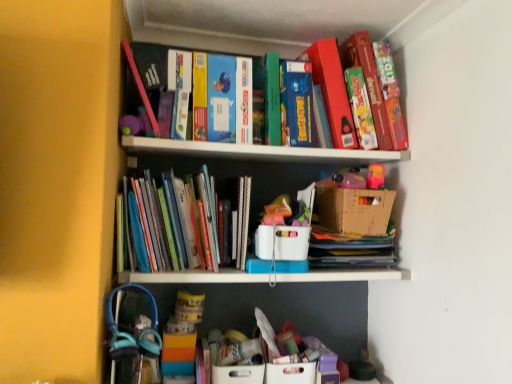
This screenshot has width=512, height=384. What do you see at coordinates (173, 224) in the screenshot?
I see `hardcover books at center` at bounding box center [173, 224].

The width and height of the screenshot is (512, 384). In order to click on hardcover books at center in this screenshot , I will do `click(173, 224)`.

Locate an element on the screen. Image resolution: width=512 pixels, height=384 pixels. hardcover books at center is located at coordinates (173, 224).

In the scene shown: Is cardboard box at upper center, placed as the second cardboard box when sorted from left to right, shorter than hardcover books at center?

Yes.

Which is more to the left, cardboard box at upper center, which is the first cardboard box in right-to-left order, or hardcover books at center?

hardcover books at center.

Based on their sizes in the image, would you say cardboard box at upper center, which is the first cardboard box in right-to-left order, is bigger or smaller than hardcover books at center?

cardboard box at upper center, which is the first cardboard box in right-to-left order, is smaller than hardcover books at center.

From the image's perspective, is cardboard box at upper center, placed as the second cardboard box when sorted from left to right, below hardcover books at center?

No, from the image's perspective, cardboard box at upper center, placed as the second cardboard box when sorted from left to right, is not below hardcover books at center.

You are a GUI agent. You are given a task and a screenshot of the screen. Output one action in this format:
    pyautogui.click(x=<x>, y=<y>)
    Task: Click on the book that is in front of the white cardboard box at center, positioned as the 1th cardboard box in left-to-right order
    The image size is (512, 384).
    Given the screenshot: What is the action you would take?
    pyautogui.click(x=173, y=224)

Which object is closer to the camera, white cardboard box at center, positioned as the 1th cardboard box in left-to-right order, or hardcover books at center?

hardcover books at center is more forward.

Considering the sizes of objects white cardboard box at center, the second cardboard box in the right-to-left sequence, and hardcover books at center in the image provided, who is bigger, white cardboard box at center, the second cardboard box in the right-to-left sequence, or hardcover books at center?

With larger size is hardcover books at center.

From the picture: From the image's perspective, which is above, white cardboard box at center, the second cardboard box in the right-to-left sequence, or hardcover books at center?

hardcover books at center, from the image's perspective.

From a real-world perspective, which is physically above, hardcover books at center or white cardboard box at center, positioned as the 1th cardboard box in left-to-right order?

In real-world perspective, hardcover books at center is above.

How far apart are hardcover books at center and white cardboard box at center, the second cardboard box in the right-to-left sequence?

hardcover books at center and white cardboard box at center, the second cardboard box in the right-to-left sequence, are 22.92 centimeters apart from each other.

Considering the relative positions of hardcover books at center and white cardboard box at center, the second cardboard box in the right-to-left sequence, in the image provided, is hardcover books at center in front of white cardboard box at center, the second cardboard box in the right-to-left sequence,?

Yes, it is in front of white cardboard box at center, the second cardboard box in the right-to-left sequence.

Looking at this image, considering the sizes of hardcover books at center and white cardboard box at center, positioned as the 1th cardboard box in left-to-right order, in the image, is hardcover books at center taller or shorter than white cardboard box at center, positioned as the 1th cardboard box in left-to-right order,?

In the image, hardcover books at center appears to be taller than white cardboard box at center, positioned as the 1th cardboard box in left-to-right order.

From the picture: Does hardcover books at center have a greater height compared to cardboard box at upper center, placed as the second cardboard box when sorted from left to right?

Yes, hardcover books at center is taller than cardboard box at upper center, placed as the second cardboard box when sorted from left to right.

Considering the relative positions of hardcover books at center and cardboard box at upper center, which is the first cardboard box in right-to-left order, in the image provided, is hardcover books at center in front of cardboard box at upper center, which is the first cardboard box in right-to-left order,?

Yes, the depth of hardcover books at center is less than that of cardboard box at upper center, which is the first cardboard box in right-to-left order.

From the image's perspective, which one is positioned lower, hardcover books at center or cardboard box at upper center, placed as the second cardboard box when sorted from left to right?

hardcover books at center is shown below in the image.

What's the angular difference between white cardboard box at center, the second cardboard box in the right-to-left sequence, and cardboard box at upper center, placed as the second cardboard box when sorted from left to right,'s facing directions?

The facing directions of white cardboard box at center, the second cardboard box in the right-to-left sequence, and cardboard box at upper center, placed as the second cardboard box when sorted from left to right, are 6.61e-06 degrees apart.

Is white cardboard box at center, the second cardboard box in the right-to-left sequence, at the right side of cardboard box at upper center, placed as the second cardboard box when sorted from left to right?

Incorrect, white cardboard box at center, the second cardboard box in the right-to-left sequence, is not on the right side of cardboard box at upper center, placed as the second cardboard box when sorted from left to right.

Does white cardboard box at center, positioned as the 1th cardboard box in left-to-right order, have a larger size compared to cardboard box at upper center, which is the first cardboard box in right-to-left order?

Actually, white cardboard box at center, positioned as the 1th cardboard box in left-to-right order, might be smaller than cardboard box at upper center, which is the first cardboard box in right-to-left order.

Is white cardboard box at center, positioned as the 1th cardboard box in left-to-right order, looking in the opposite direction of cardboard box at upper center, placed as the second cardboard box when sorted from left to right?

No, white cardboard box at center, positioned as the 1th cardboard box in left-to-right order, is not facing away from cardboard box at upper center, placed as the second cardboard box when sorted from left to right.

From a real-world perspective, is cardboard box at upper center, placed as the second cardboard box when sorted from left to right, physically located above or below white cardboard box at center, the second cardboard box in the right-to-left sequence?

From a real-world perspective, cardboard box at upper center, placed as the second cardboard box when sorted from left to right, is physically above white cardboard box at center, the second cardboard box in the right-to-left sequence.

Looking at this image, is cardboard box at upper center, placed as the second cardboard box when sorted from left to right, surrounding white cardboard box at center, positioned as the 1th cardboard box in left-to-right order?

Actually, white cardboard box at center, positioned as the 1th cardboard box in left-to-right order, is outside cardboard box at upper center, placed as the second cardboard box when sorted from left to right.

From the image's perspective, is cardboard box at upper center, placed as the second cardboard box when sorted from left to right, under white cardboard box at center, the second cardboard box in the right-to-left sequence?

No, from the image's perspective, cardboard box at upper center, placed as the second cardboard box when sorted from left to right, is not below white cardboard box at center, the second cardboard box in the right-to-left sequence.

Considering the sizes of objects cardboard box at upper center, which is the first cardboard box in right-to-left order, and white cardboard box at center, positioned as the 1th cardboard box in left-to-right order, in the image provided, who is wider, cardboard box at upper center, which is the first cardboard box in right-to-left order, or white cardboard box at center, positioned as the 1th cardboard box in left-to-right order,?

Wider between the two is white cardboard box at center, positioned as the 1th cardboard box in left-to-right order.

At what (x,y) coordinates should I click in order to perform the action: click on book that appears in front of the cardboard box at upper center, placed as the second cardboard box when sorted from left to right. Please return your answer as a coordinate pair (x, y). Looking at the image, I should click on (173, 224).

I want to click on the 1st cardboard box behind the hardcover books at center, starting your count from the anchor, so [282, 242].

Estimate the real-world distances between objects in this image. Which object is closer to hardcover books at center, white cardboard box at center, the second cardboard box in the right-to-left sequence, or cardboard box at upper center, placed as the second cardboard box when sorted from left to right?

white cardboard box at center, the second cardboard box in the right-to-left sequence.

Based on their spatial positions, is white cardboard box at center, positioned as the 1th cardboard box in left-to-right order, or hardcover books at center closer to cardboard box at upper center, placed as the second cardboard box when sorted from left to right?

Based on the image, white cardboard box at center, positioned as the 1th cardboard box in left-to-right order, appears to be nearer to cardboard box at upper center, placed as the second cardboard box when sorted from left to right.

Based on the photo, considering their positions, is cardboard box at upper center, placed as the second cardboard box when sorted from left to right, positioned closer to hardcover books at center than white cardboard box at center, positioned as the 1th cardboard box in left-to-right order?

white cardboard box at center, positioned as the 1th cardboard box in left-to-right order, is positioned closer to the anchor hardcover books at center.

When comparing their distances from white cardboard box at center, positioned as the 1th cardboard box in left-to-right order, does hardcover books at center or cardboard box at upper center, placed as the second cardboard box when sorted from left to right, seem closer?

cardboard box at upper center, placed as the second cardboard box when sorted from left to right.

Based on their spatial positions, is hardcover books at center or white cardboard box at center, the second cardboard box in the right-to-left sequence, closer to cardboard box at upper center, which is the first cardboard box in right-to-left order?

white cardboard box at center, the second cardboard box in the right-to-left sequence, is positioned closer to the anchor cardboard box at upper center, which is the first cardboard box in right-to-left order.

From the image, which object appears to be nearer to white cardboard box at center, positioned as the 1th cardboard box in left-to-right order, cardboard box at upper center, placed as the second cardboard box when sorted from left to right, or hardcover books at center?

Among the two, cardboard box at upper center, placed as the second cardboard box when sorted from left to right, is located nearer to white cardboard box at center, positioned as the 1th cardboard box in left-to-right order.

Where is `cardboard box between hardcover books at center and cardboard box at upper center, which is the first cardboard box in right-to-left order, in the horizontal direction`? cardboard box between hardcover books at center and cardboard box at upper center, which is the first cardboard box in right-to-left order, in the horizontal direction is located at coordinates (282, 242).